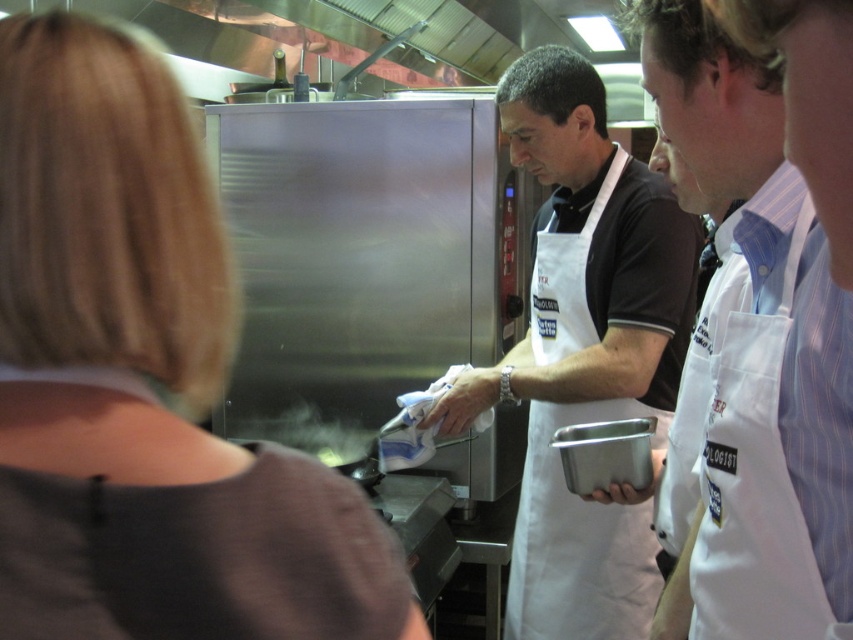
Question: Is brown matte shirt at upper left above white fabric apron at center?

Choices:
 (A) yes
 (B) no

Answer: (A)

Question: Is brown matte shirt at upper left wider than white fabric apron at center?

Choices:
 (A) no
 (B) yes

Answer: (A)

Question: Observing the image, what is the correct spatial positioning of brown matte shirt at upper left in reference to white apron at right?

Choices:
 (A) right
 (B) left

Answer: (B)

Question: Which object is closer to the camera taking this photo?

Choices:
 (A) brown matte shirt at upper left
 (B) white apron at right
 (C) white apron at center
 (D) white fabric apron at center

Answer: (A)

Question: Which is farther from the white fabric apron at center?

Choices:
 (A) brown matte shirt at upper left
 (B) white apron at right
 (C) white apron at center

Answer: (A)

Question: Among these points, which one is farthest from the camera?

Choices:
 (A) (770, 365)
 (B) (614, 275)
 (C) (543, 376)
 (D) (108, 86)

Answer: (C)